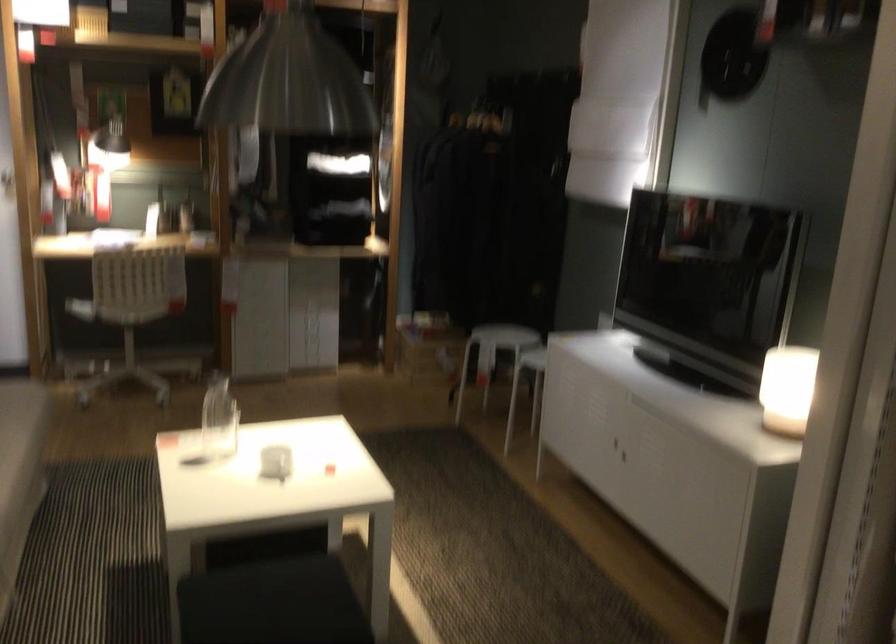
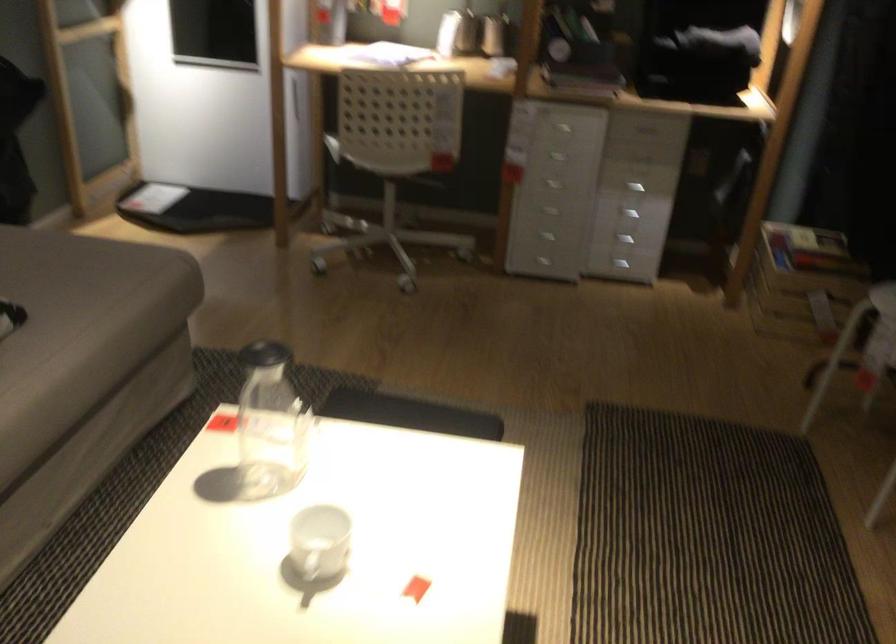
Find the pixel in the second image that matches [277,476] in the first image.

(320, 542)